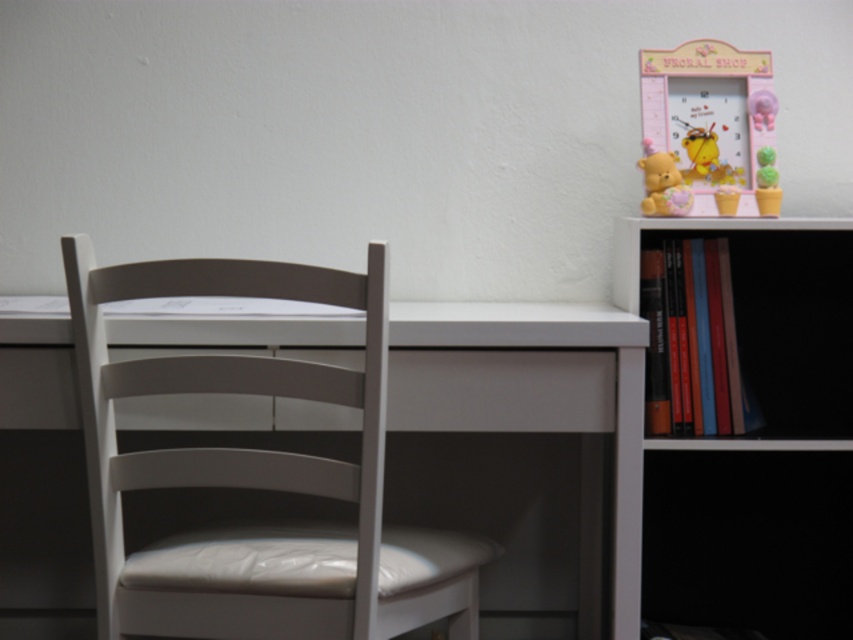
Question: Which object is the farthest from the white matte bookshelf at right?

Choices:
 (A) white leather chair at left
 (B) matte plastic bear at upper right
 (C) green felt cactus at upper right

Answer: (A)

Question: Considering the relative positions of white leather chair at left and matte plastic bear at upper right in the image provided, where is white leather chair at left located with respect to matte plastic bear at upper right?

Choices:
 (A) above
 (B) below

Answer: (B)

Question: Among these objects, which one is nearest to the camera?

Choices:
 (A) white matte bookshelf at right
 (B) green felt cactus at upper right
 (C) matte plastic bear at upper right

Answer: (A)

Question: Does white leather chair at left have a smaller size compared to white matte bookshelf at right?

Choices:
 (A) yes
 (B) no

Answer: (A)

Question: Does white leather chair at left lie behind green felt cactus at upper right?

Choices:
 (A) no
 (B) yes

Answer: (A)

Question: Which of these objects is positioned closest to the white matte bookshelf at right?

Choices:
 (A) white leather chair at left
 (B) matte plastic bear at upper right
 (C) green felt cactus at upper right

Answer: (B)